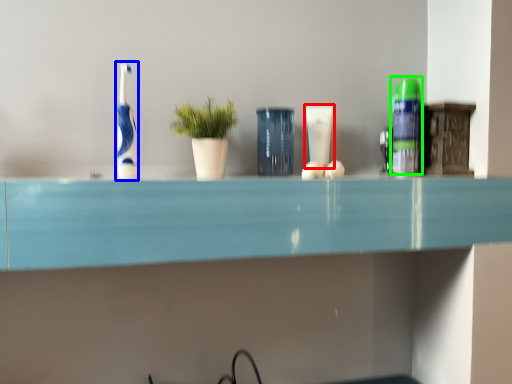
Question: Considering the real-world distances, which object is closest to toiletry (highlighted by a red box)? toothbrush (highlighted by a blue box) or toiletry (highlighted by a green box).

Choices:
 (A) toothbrush
 (B) toiletry

Answer: (B)